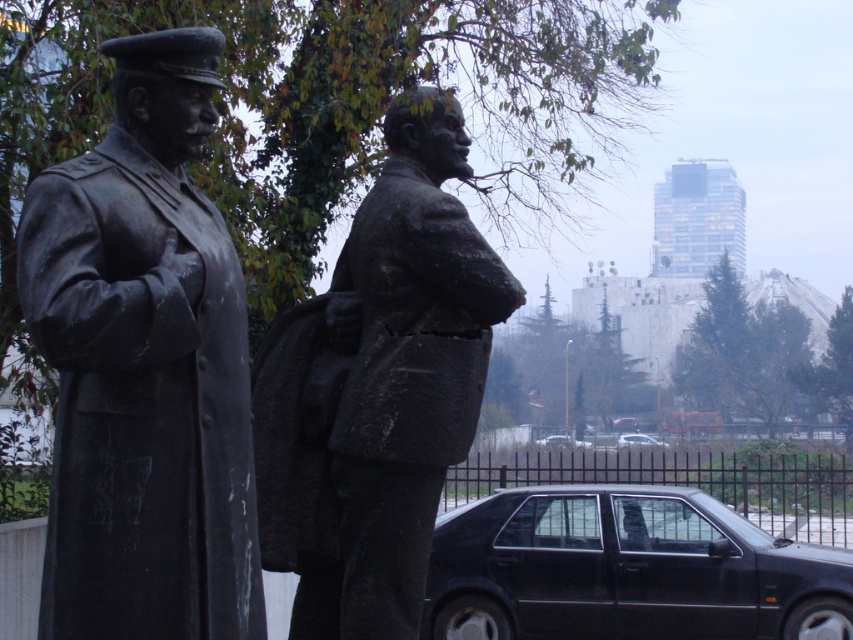
In the scene shown: You are standing in the public space where the two bronze statues are located. You want to take a photo of the bronze statue at left from a position that ensures the statue is centered in your camera frame. Given that your camera has a field of view of 60 degrees, can you determine if the point at coordinates point (x=144, y=368) is within the camera frame when centered on the bronze statue at left?

The point (x=144, y=368) is on bronze statue at left, so when the camera is centered on the bronze statue at left, the point should be within the camera frame as long as the statue is fully within the 60 degree field of view.

From the picture: You are standing in a public space and see the bronze statue at left and the metallic silver car at center. If you walk straight ahead, which object will you encounter first?

The bronze statue at left is closer to the viewer than the metallic silver car at center, so you will encounter the bronze statue at left first.